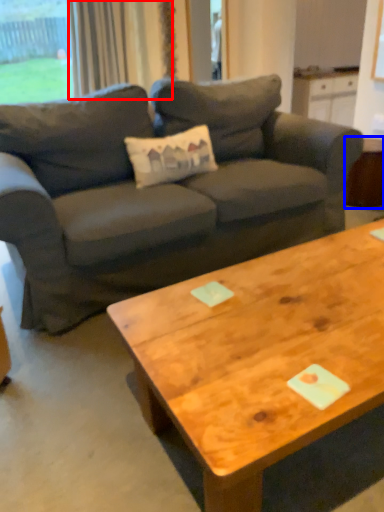
Question: Which object appears closest to the camera in this image, curtain (highlighted by a red box) or side table (highlighted by a blue box)?

Choices:
 (A) curtain
 (B) side table

Answer: (B)